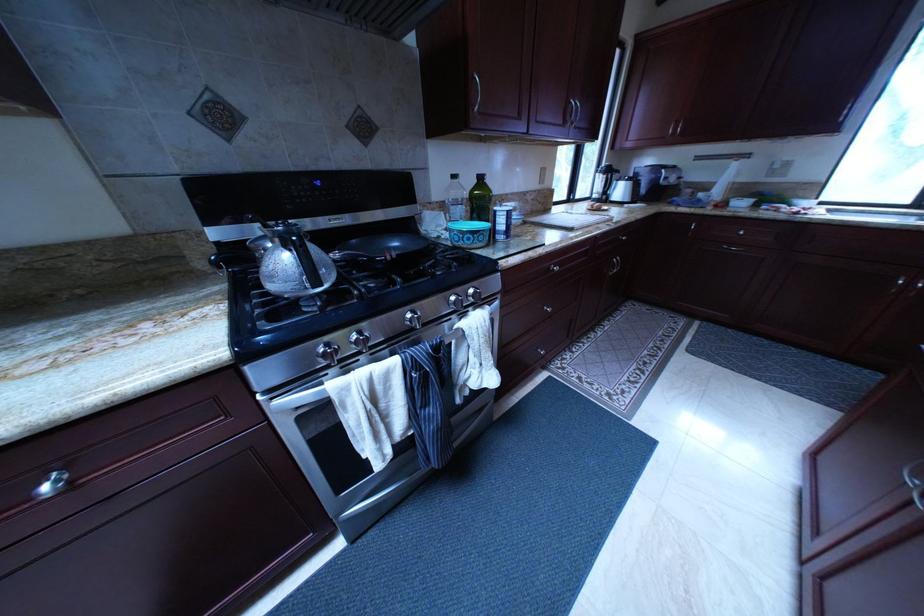
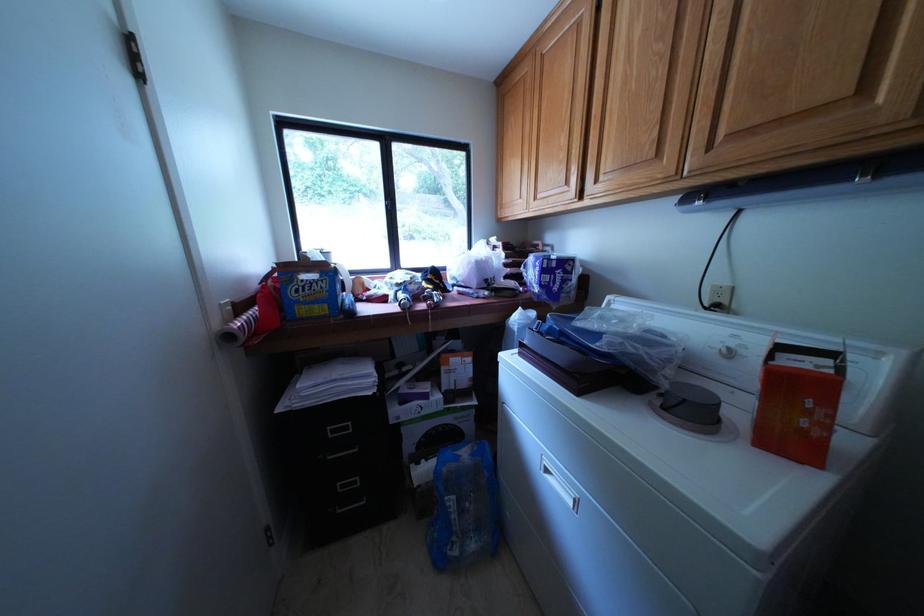
The images are taken continuously from a first-person perspective. In which direction are you moving?

The cameraman walked toward left, backward.